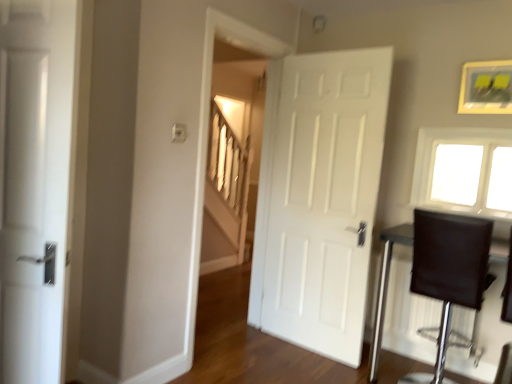
Question: Does white matte door at left, which is the first door in front-to-back order, have a greater width compared to white glass window at upper right?

Choices:
 (A) yes
 (B) no

Answer: (B)

Question: Is white matte door at left, which is counted as the 1th door, starting from the left, not near white glass window at upper right?

Choices:
 (A) no
 (B) yes

Answer: (B)

Question: Is white matte door at left, which is the first door in front-to-back order, taller than white glass window at upper right?

Choices:
 (A) no
 (B) yes

Answer: (B)

Question: Is white matte door at left, which is the first door in front-to-back order, positioned beyond the bounds of white glass window at upper right?

Choices:
 (A) no
 (B) yes

Answer: (B)

Question: Is white matte door at left, which is the first door in front-to-back order, to the left of white glass window at upper right from the viewer's perspective?

Choices:
 (A) no
 (B) yes

Answer: (B)

Question: From a real-world perspective, is white matte door at left, which is the first door in front-to-back order, positioned over white glass window at upper right based on gravity?

Choices:
 (A) no
 (B) yes

Answer: (A)

Question: Is the position of gold-framed picture at upper right more distant than that of white glass window at upper right?

Choices:
 (A) no
 (B) yes

Answer: (A)

Question: From a real-world perspective, is gold-framed picture at upper right physically below white glass window at upper right?

Choices:
 (A) no
 (B) yes

Answer: (A)

Question: From the image's perspective, is gold-framed picture at upper right located beneath white glass window at upper right?

Choices:
 (A) no
 (B) yes

Answer: (A)

Question: Is gold-framed picture at upper right beside white glass window at upper right?

Choices:
 (A) no
 (B) yes

Answer: (A)

Question: Is gold-framed picture at upper right closer to camera compared to white glass window at upper right?

Choices:
 (A) no
 (B) yes

Answer: (B)

Question: From the image's perspective, is gold-framed picture at upper right located above white glass window at upper right?

Choices:
 (A) no
 (B) yes

Answer: (B)

Question: Is white matte door at left, placed as the second door when sorted from back to front, at the left side of gold-framed picture at upper right?

Choices:
 (A) no
 (B) yes

Answer: (B)